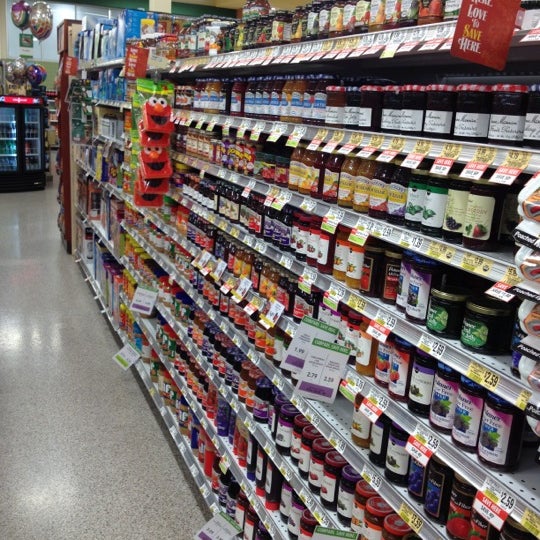
Find the location of a particular element. shelf is located at coordinates (396, 405).